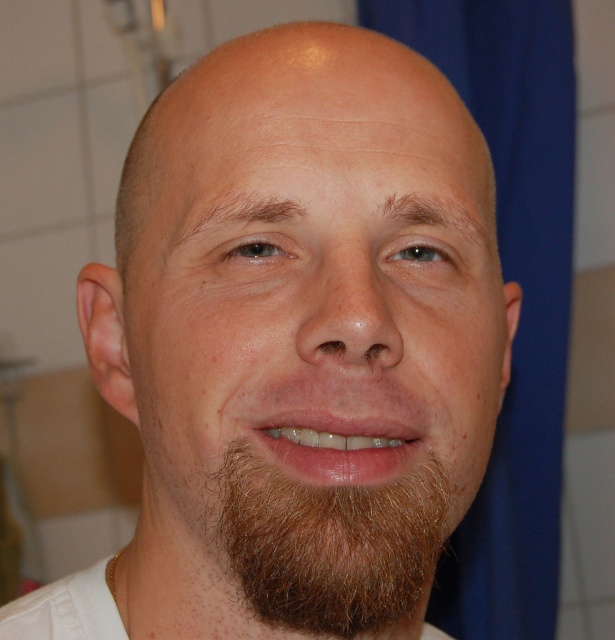
This screenshot has width=615, height=640. Find the location of `brown matte beard at center`. brown matte beard at center is located at coordinates coord(300,337).

Is point (387, 422) closer to viewer compared to point (403, 550)?

Yes, it is.

Where is `brown matte beard at center`? Image resolution: width=615 pixels, height=640 pixels. brown matte beard at center is located at coordinates (300, 337).